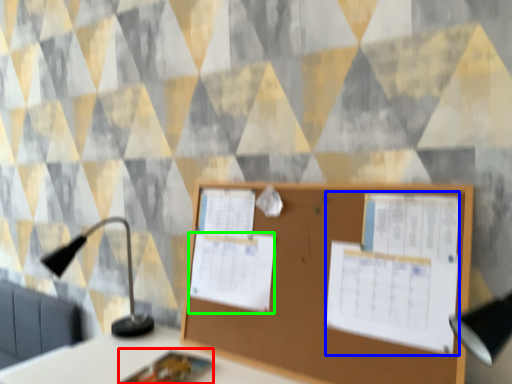
Question: Which object is the farthest from notebook (highlighted by a red box)? Choose among these: poster (highlighted by a blue box) or poster (highlighted by a green box).

Choices:
 (A) poster
 (B) poster

Answer: (A)